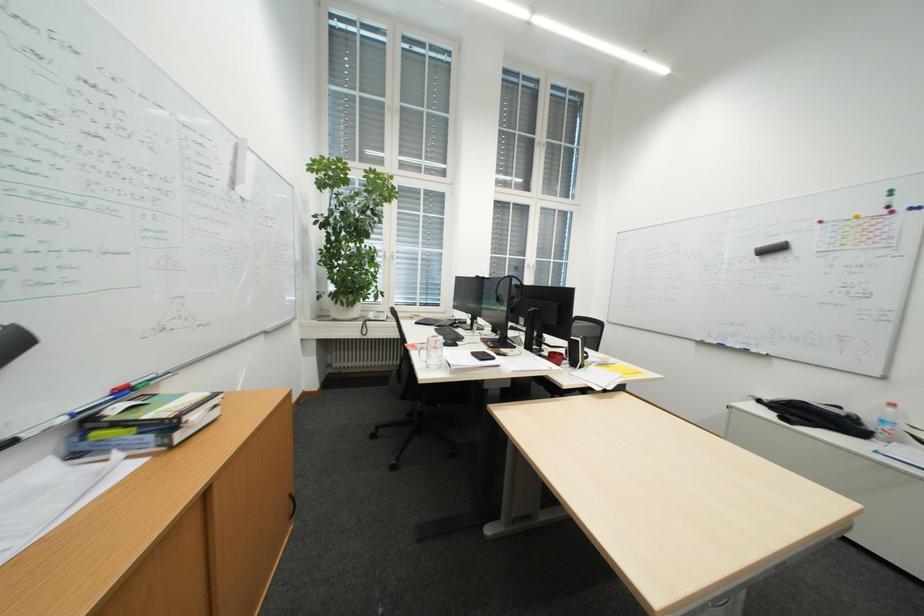
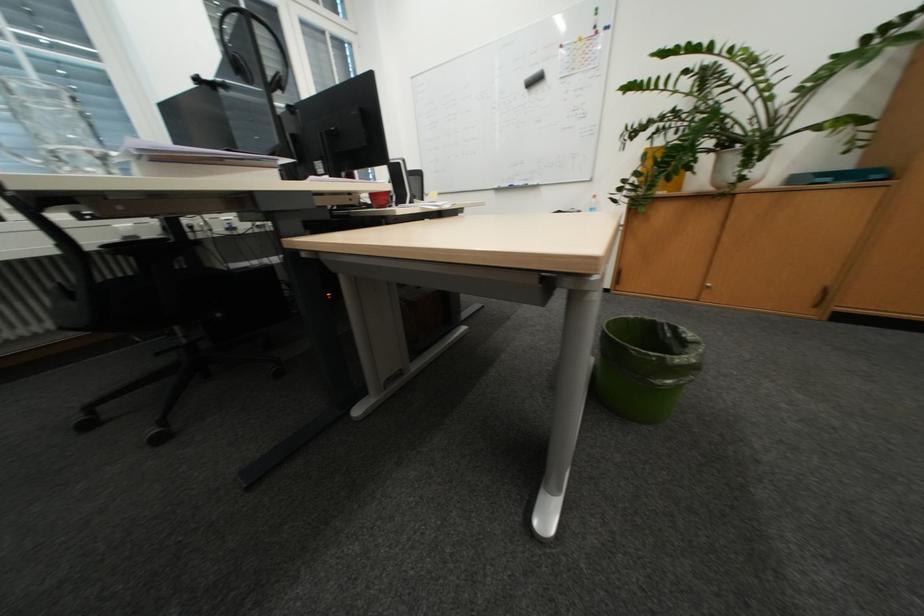
The first image is from the beginning of the video and the second image is from the end. How did the camera likely rotate when shooting the video?

The camera's rotation is toward right-down.